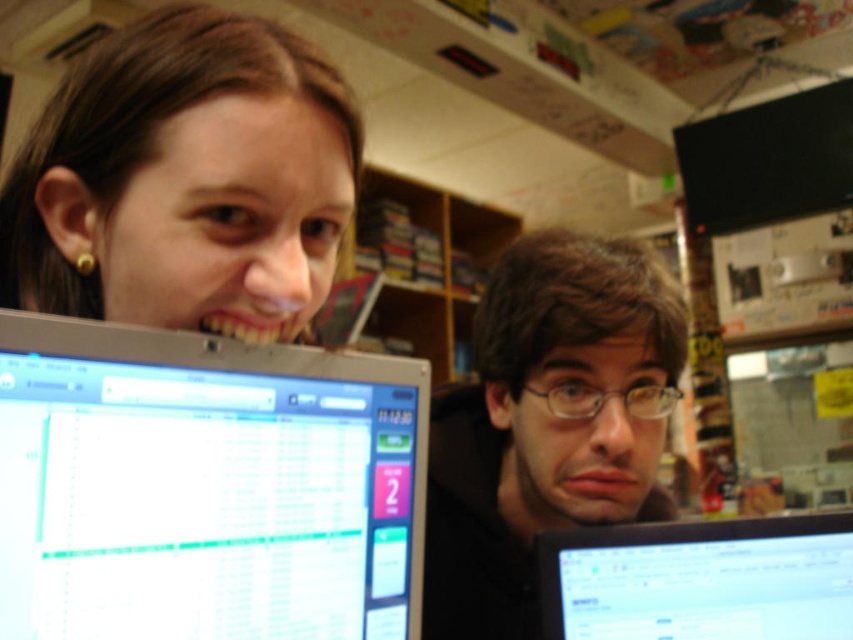
Question: Observing the image, what is the correct spatial positioning of silver metallic monitor at left in reference to matte black face at upper left?

Choices:
 (A) right
 (B) left

Answer: (A)

Question: Which object appears farthest from the camera in this image?

Choices:
 (A) matte black face at upper left
 (B) silver metallic monitor at left

Answer: (A)

Question: Which object appears farthest from the camera in this image?

Choices:
 (A) wooden shelves at center
 (B) silver metallic monitor at left
 (C) black glossy monitor at lower right

Answer: (A)

Question: Which of the following is the farthest from the observer?

Choices:
 (A) (80, 118)
 (B) (828, 545)
 (C) (469, 259)

Answer: (C)

Question: Can you confirm if silver metallic monitor at left is wider than wooden shelves at center?

Choices:
 (A) yes
 (B) no

Answer: (B)

Question: Can you confirm if silver metallic monitor at left is positioned to the left of matte black face at upper left?

Choices:
 (A) yes
 (B) no

Answer: (B)